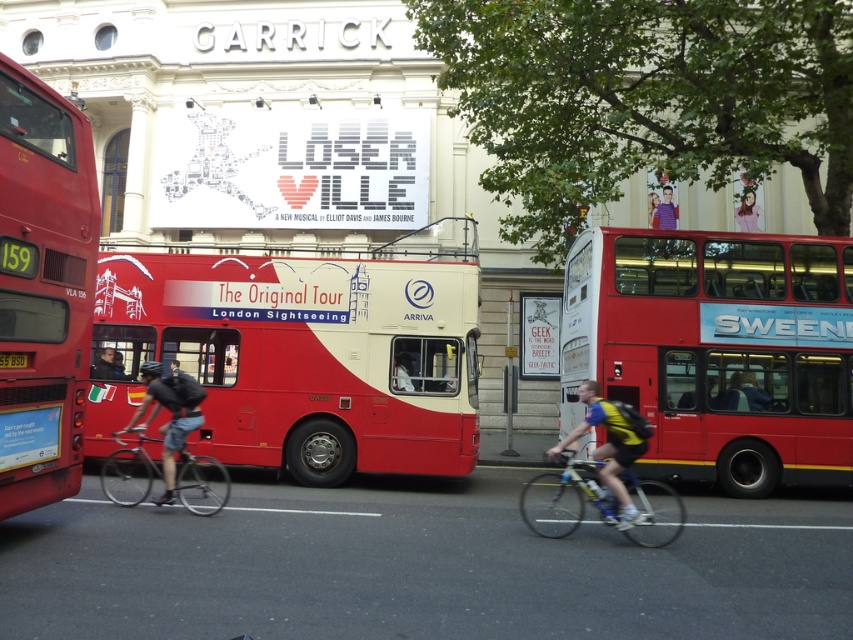
Does red matte double-decker bus at right have a greater width compared to silver metallic bicycle at center?

Correct, the width of red matte double-decker bus at right exceeds that of silver metallic bicycle at center.

Between red matte double-decker bus at right and silver metallic bicycle at center, which one has less height?

With less height is silver metallic bicycle at center.

Locate an element on the screen. red matte double-decker bus at right is located at coordinates (717, 349).

Does red matte bus at center have a greater height compared to purple fabric shirt at upper center?

Incorrect, red matte bus at center's height is not larger of purple fabric shirt at upper center's.

Does red matte bus at center have a larger size compared to purple fabric shirt at upper center?

No.

Is point (351, 280) in front of point (666, 220)?

Yes, point (351, 280) is closer to viewer.

Where is `red matte bus at center`? red matte bus at center is located at coordinates (303, 353).

Is red matte double-decker bus at left positioned behind purple fabric shirt at upper center?

No, red matte double-decker bus at left is closer to the viewer.

Which is below, red matte double-decker bus at left or purple fabric shirt at upper center?

red matte double-decker bus at left

Between point (38, 381) and point (672, 227), which one is positioned behind?

Positioned behind is point (672, 227).

Where is `red matte double-decker bus at left`? Image resolution: width=853 pixels, height=640 pixels. red matte double-decker bus at left is located at coordinates (44, 289).